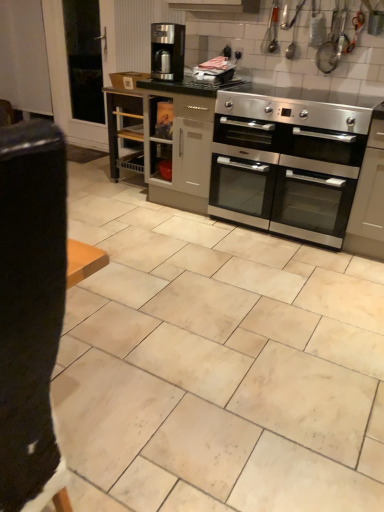
Locate an element on the screen. This screenshot has width=384, height=512. free space above beige matte tile at center (from a real-world perspective) is located at coordinates (188, 265).